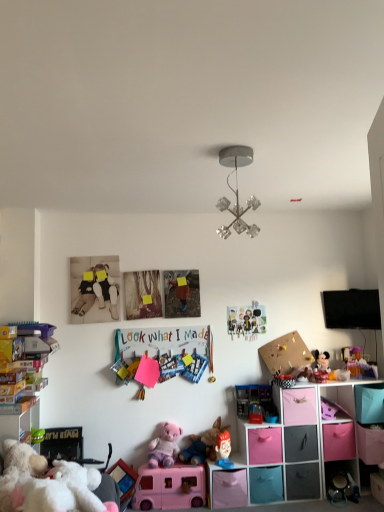
Image resolution: width=384 pixels, height=512 pixels. What do you see at coordinates (195, 368) in the screenshot?
I see `blue plastic toy at center, which ranks as the fourth toy in left-to-right order` at bounding box center [195, 368].

The height and width of the screenshot is (512, 384). Describe the element at coordinates (302, 481) in the screenshot. I see `matte plastic drawer at lower right, placed as the 5th drawer when sorted from left to right` at that location.

Measure the distance between point (242, 478) and camera.

Point (242, 478) and camera are 3.28 meters apart from each other.

What is the approximate height of white plush bear at lower left, which appears as the 10th toy when viewed from the right?

11.89 inches.

Where is `white plush bear at lower left, which appears as the 10th toy when viewed from the right`? This screenshot has width=384, height=512. white plush bear at lower left, which appears as the 10th toy when viewed from the right is located at coordinates (49, 486).

I want to click on pink fabric drawer at lower right, which is the 1th drawer in right-to-left order, so click(339, 441).

How different are the orientations of blue plastic toy at center, which ranks as the seventh toy in right-to-left order, and plush mickey mouse at center right, which ranks as the 2th toy in right-to-left order, in degrees?

0.787 degrees.

Is blue plastic toy at center, which ranks as the seventh toy in right-to-left order, bigger than plush mickey mouse at center right, arranged as the 9th toy when viewed from the left?

No.

Which object is wider, blue plastic toy at center, which ranks as the fourth toy in left-to-right order, or plush mickey mouse at center right, which ranks as the 2th toy in right-to-left order?

Wider between the two is plush mickey mouse at center right, which ranks as the 2th toy in right-to-left order.

From a real-world perspective, which is physically below, blue plastic toy at center, which ranks as the fourth toy in left-to-right order, or plush mickey mouse at center right, arranged as the 9th toy when viewed from the left?

In real-world perspective, plush mickey mouse at center right, arranged as the 9th toy when viewed from the left, is lower.

Is blue plastic toy at center, which ranks as the fourth toy in left-to-right order, located within pink fabric storage cubes at lower right?

No.

Which of these two, pink fabric storage cubes at lower right or blue plastic toy at center, which ranks as the seventh toy in right-to-left order, stands taller?

Standing taller between the two is pink fabric storage cubes at lower right.

Is pink fabric storage cubes at lower right facing away from blue plastic toy at center, which ranks as the seventh toy in right-to-left order?

No, pink fabric storage cubes at lower right is not facing the opposite direction of blue plastic toy at center, which ranks as the seventh toy in right-to-left order.

From a real-world perspective, is pink fabric storage cubes at lower right on top of blue plastic toy at center, which ranks as the seventh toy in right-to-left order?

Incorrect, from a real-world perspective, pink fabric storage cubes at lower right is lower than blue plastic toy at center, which ranks as the seventh toy in right-to-left order.

Is pink fabric storage cubes at lower right far from pink matte drawer at lower center, positioned as the 6th drawer in right-to-left order?

Actually, pink fabric storage cubes at lower right and pink matte drawer at lower center, positioned as the 6th drawer in right-to-left order, are a little close together.

From the image's perspective, is pink fabric storage cubes at lower right below pink matte drawer at lower center, positioned as the 6th drawer in right-to-left order?

No, from the image's perspective, pink fabric storage cubes at lower right is not beneath pink matte drawer at lower center, positioned as the 6th drawer in right-to-left order.

Who is taller, pink fabric storage cubes at lower right or pink matte drawer at lower center, the 1th drawer when ordered from left to right?

Standing taller between the two is pink fabric storage cubes at lower right.

How different are the orientations of pink fabric storage cubes at lower right and pink matte drawer at lower center, the 1th drawer when ordered from left to right, in degrees?

They differ by 0.000165 degrees in their facing directions.

Do you think pink plastic toy bus at lower center, which is counted as the third toy, starting from the left, is within white plush bear at lower left, which appears as the 10th toy when viewed from the right, or outside of it?

The correct answer is: outside.

Find the location of a particular element. This screenshot has height=512, width=384. the 4th toy above the pink plastic toy bus at lower center, positioned as the eighth toy in right-to-left order (from a real-world perspective) is located at coordinates (49, 486).

Can you confirm if pink plastic toy bus at lower center, which is counted as the third toy, starting from the left, is shorter than white plush bear at lower left, which is counted as the first toy, starting from the left?

No.

How much distance is there between pink plastic toy bus at lower center, which is counted as the third toy, starting from the left, and white plush bear at lower left, which is counted as the first toy, starting from the left?

The distance of pink plastic toy bus at lower center, which is counted as the third toy, starting from the left, from white plush bear at lower left, which is counted as the first toy, starting from the left, is 3.75 feet.

How many degrees apart are the facing directions of metallic crystal chandelier at center and plush mickey mouse at center right, arranged as the 9th toy when viewed from the left?

The angle between the facing direction of metallic crystal chandelier at center and the facing direction of plush mickey mouse at center right, arranged as the 9th toy when viewed from the left, is 0.799 degrees.

Considering the points (238, 152) and (327, 369), which point is in front, point (238, 152) or point (327, 369)?

Positioned in front is point (238, 152).

Is metallic crystal chandelier at center completely or partially outside of plush mickey mouse at center right, which ranks as the 2th toy in right-to-left order?

Yes, metallic crystal chandelier at center is located beyond the bounds of plush mickey mouse at center right, which ranks as the 2th toy in right-to-left order.

Based on their positions, is metallic crystal chandelier at center located to the left or right of plush mickey mouse at center right, which ranks as the 2th toy in right-to-left order?

From the image, it's evident that metallic crystal chandelier at center is to the left of plush mickey mouse at center right, which ranks as the 2th toy in right-to-left order.

Is gray matte drawer at lower right, the 3th drawer positioned from the right, spatially inside metallic crystal chandelier at center, or outside of it?

The correct answer is: outside.

Is gray matte drawer at lower right, the 3th drawer positioned from the right, far away from metallic crystal chandelier at center?

Absolutely, gray matte drawer at lower right, the 3th drawer positioned from the right, is distant from metallic crystal chandelier at center.

Does point (306, 431) come closer to viewer compared to point (237, 202)?

That is False.

Does gray matte drawer at lower right, the fourth drawer positioned from the left, appear on the left side of metallic crystal chandelier at center?

In fact, gray matte drawer at lower right, the fourth drawer positioned from the left, is to the right of metallic crystal chandelier at center.

Does point (228, 441) come behind point (278, 429)?

Yes.

Which drawer is the 2nd one when counting from the right side of the matte plastic toy at lower center, positioned as the fifth toy in right-to-left order? Please provide its 2D coordinates.

[(265, 445)]

Could you tell me if matte plastic toy at lower center, positioned as the fifth toy in right-to-left order, is turned towards pink fabric drawer at lower right, the 5th drawer positioned from the right?

No, matte plastic toy at lower center, positioned as the fifth toy in right-to-left order, does not turn towards pink fabric drawer at lower right, the 5th drawer positioned from the right.

Is matte plastic toy at lower center, which appears as the 6th toy when viewed from the left, at the right side of pink fabric drawer at lower right, which ranks as the 2th drawer in left-to-right order?

No, matte plastic toy at lower center, which appears as the 6th toy when viewed from the left, is not to the right of pink fabric drawer at lower right, which ranks as the 2th drawer in left-to-right order.

You are a GUI agent. You are given a task and a screenshot of the screen. Output one action in this format:
    pyautogui.click(x=<x>, y=<y>)
    Task: Click on the toy that is the 5th one when counting leftward from the plush mickey mouse at center right, arranged as the 9th toy when viewed from the left
    This screenshot has width=384, height=512.
    Given the screenshot: What is the action you would take?
    pyautogui.click(x=195, y=368)

The width and height of the screenshot is (384, 512). Identify the location of shelf beneath the blue plastic toy at center, which ranks as the fourth toy in left-to-right order (from a real-world perspective). (292, 448).

Considering their positions, is pink fabric storage cube at lower right positioned further to pink plastic toy bus at lower center, positioned as the eighth toy in right-to-left order, than pink fabric storage cubes at lower right?

Based on the image, pink fabric storage cube at lower right appears to be further to pink plastic toy bus at lower center, positioned as the eighth toy in right-to-left order.

Based on their spatial positions, is translucent plastic toy at right, which is counted as the 1th toy, starting from the right, or pink fabric drawer at lower right, the 6th drawer positioned from the left, closer to matte plastic toy at lower center, positioned as the fifth toy in right-to-left order?

pink fabric drawer at lower right, the 6th drawer positioned from the left, lies closer to matte plastic toy at lower center, positioned as the fifth toy in right-to-left order, than the other object.

When comparing their distances from plush pink teddy bear at center, positioned as the 9th toy in right-to-left order, does pink fabric storage cubes at lower right or blue plastic toy at center, which ranks as the seventh toy in right-to-left order, seem closer?

Based on the image, blue plastic toy at center, which ranks as the seventh toy in right-to-left order, appears to be nearer to plush pink teddy bear at center, positioned as the 9th toy in right-to-left order.

Which object lies nearer to the anchor point matte plastic drawer at lower right, placed as the 5th drawer when sorted from left to right, translucent plastic toy at center, the 8th toy when ordered from left to right, or gray matte drawer at lower right, the 3th drawer positioned from the right?

The object closer to matte plastic drawer at lower right, placed as the 5th drawer when sorted from left to right, is gray matte drawer at lower right, the 3th drawer positioned from the right.

Considering their positions, is translucent plastic toy at center, the 8th toy when ordered from left to right, positioned closer to pink fabric storage cube at lower right than plush mickey mouse at center right, arranged as the 9th toy when viewed from the left?

plush mickey mouse at center right, arranged as the 9th toy when viewed from the left, is positioned closer to the anchor pink fabric storage cube at lower right.

Which object lies further to the anchor point plush fabric toy at center, marked as the sixth toy in a right-to-left arrangement, gray matte drawer at lower right, the 3th drawer positioned from the right, or translucent plastic toy at right, the tenth toy in the left-to-right sequence?

translucent plastic toy at right, the tenth toy in the left-to-right sequence, is further to plush fabric toy at center, marked as the sixth toy in a right-to-left arrangement.

Based on their spatial positions, is pink matte drawer at lower center, the 1th drawer when ordered from left to right, or plush mickey mouse at center right, arranged as the 9th toy when viewed from the left, further from pink fabric storage cubes at lower right?

plush mickey mouse at center right, arranged as the 9th toy when viewed from the left.

Based on their spatial positions, is blue plastic toy at center, which ranks as the seventh toy in right-to-left order, or plush pink teddy bear at center, acting as the second toy starting from the left, closer to pink fabric storage cubes at lower right?

plush pink teddy bear at center, acting as the second toy starting from the left, lies closer to pink fabric storage cubes at lower right than the other object.

Locate an element on the screen. This screenshot has width=384, height=512. cabinet between plush mickey mouse at center right, which ranks as the 2th toy in right-to-left order, and pink fabric storage cubes at lower right from top to bottom is located at coordinates (336, 402).

This screenshot has width=384, height=512. I want to click on shelf between plush pink teddy bear at center, positioned as the 9th toy in right-to-left order, and pink fabric storage cube at lower right, in the horizontal direction, so click(292, 448).

Locate an element on the screen. This screenshot has height=512, width=384. cabinet between metallic crystal chandelier at center and matte plastic toy at lower center, positioned as the fifth toy in right-to-left order, vertically is located at coordinates (336, 402).

Identify the location of cabinet that lies between metallic crystal chandelier at center and pink fabric drawer at lower right, which is the 1th drawer in right-to-left order, from top to bottom. This screenshot has height=512, width=384. (336, 402).